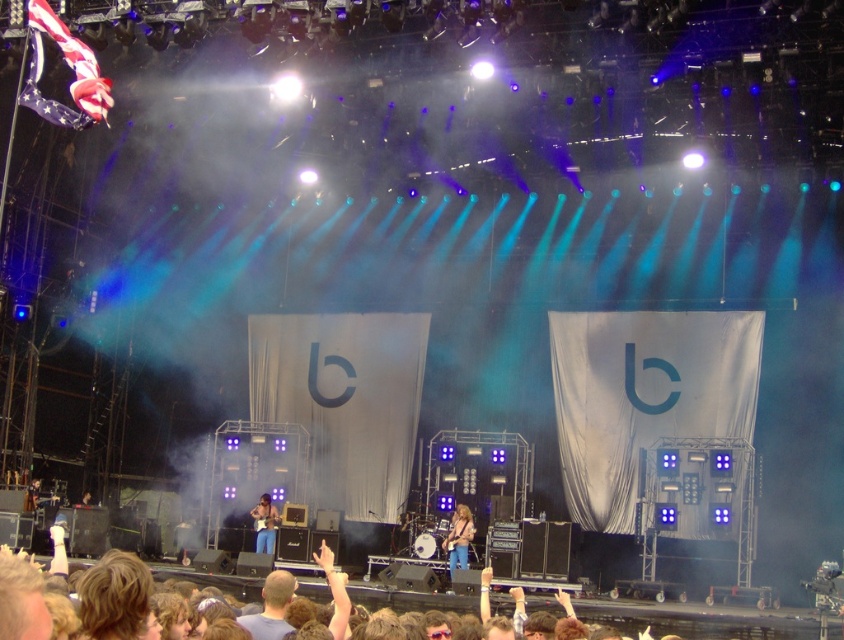
Does blue jeans at center appear on the left side of matte blue jeans at center?

Incorrect, blue jeans at center is not on the left side of matte blue jeans at center.

Is point (650, 630) closer to viewer compared to point (266, 525)?

That is True.

What are the coordinates of `blue jeans at center` in the screenshot? It's located at (333, 582).

Looking at this image, does blue jeans at center have a lesser width compared to blue denim jeans at center?

No.

Looking at this image, between blue jeans at center and blue denim jeans at center, which one is positioned lower?

blue denim jeans at center is lower down.

Between point (95, 612) and point (458, 548), which one is positioned behind?

The point (458, 548) is more distant.

Identify the location of blue jeans at center. The height and width of the screenshot is (640, 844). (333, 582).

Is blue denim jeans at center taller than matte blue jeans at center?

In fact, blue denim jeans at center may be shorter than matte blue jeans at center.

What do you see at coordinates (458, 538) in the screenshot?
I see `blue denim jeans at center` at bounding box center [458, 538].

At what (x,y) coordinates should I click in order to perform the action: click on blue denim jeans at center. Please return your answer as a coordinate pair (x, y). Looking at the image, I should click on (458, 538).